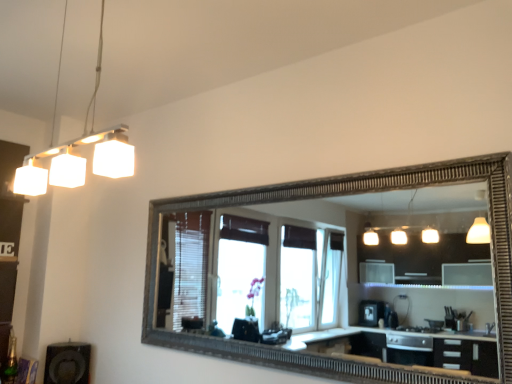
Question: Is black matte speaker at lower left wider or thinner than white matte light fixture at upper left?

Choices:
 (A) wide
 (B) thin

Answer: (A)

Question: Is black matte speaker at lower left taller or shorter than white matte light fixture at upper left?

Choices:
 (A) short
 (B) tall

Answer: (A)

Question: Which is nearer to the black matte speaker at lower left?

Choices:
 (A) matte white dresser at left
 (B) white matte light fixture at upper left

Answer: (A)

Question: Which of these objects is positioned closest to the white matte light fixture at upper left?

Choices:
 (A) black matte speaker at lower left
 (B) matte white dresser at left

Answer: (B)